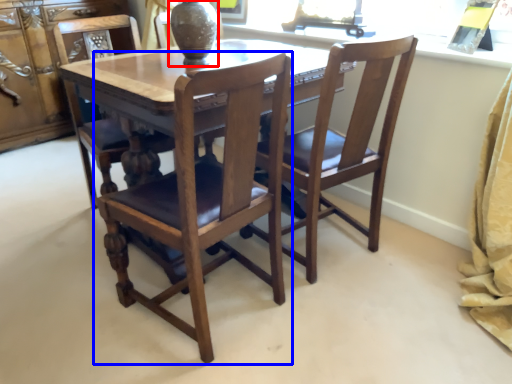
Question: Which point is further to the camera, glass vase (highlighted by a red box) or chair (highlighted by a blue box)?

Choices:
 (A) glass vase
 (B) chair

Answer: (A)